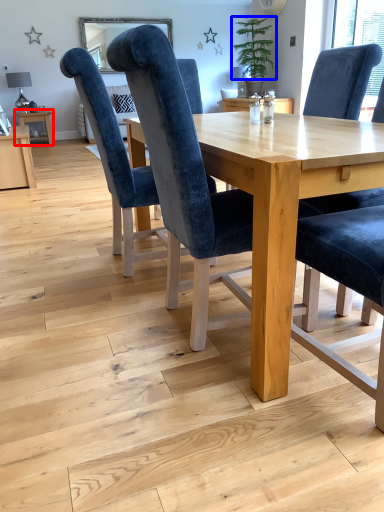
Question: Which point is closer to the camera, table (highlighted by a red box) or plant (highlighted by a blue box)?

Choices:
 (A) table
 (B) plant

Answer: (B)